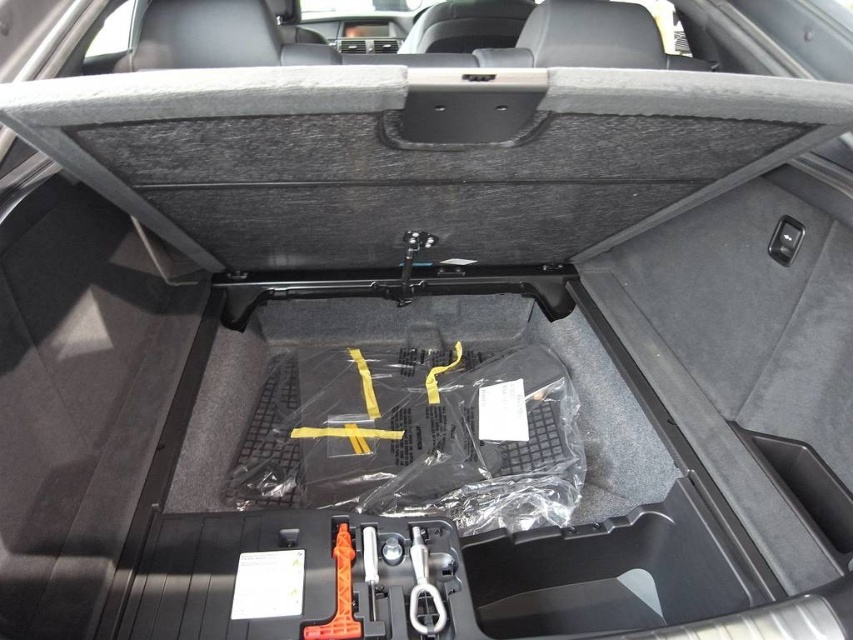
You are trying to locate the orange plastic tool at lower center in the car trunk. According to the image, what is its exact 2D coordinate position?

The orange plastic tool at lower center is located at the 2D coordinate point of (339, 593).

You are trying to locate the metallic silver wrench at center in the car trunk. According to the image, where exactly is it positioned?

The metallic silver wrench at center is located at the 2D coordinates point [422,588] in the image.

You are trying to place a small package in the trunk of the car. You have two points marked in the trunk area. Which point is closer to the front of the trunk? The points are point (303, 628) and point (416, 536).

Point (303, 628) is in front of point (416, 536), so it is closer to the front of the trunk.